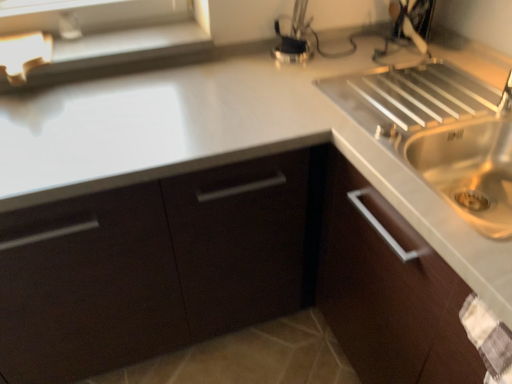
Question: Does point (103, 9) appear closer or farther from the camera than point (221, 208)?

Choices:
 (A) closer
 (B) farther

Answer: (B)

Question: From a real-world perspective, relative to matte dark brown cabinet at center, is matte white window sill at upper left vertically above or below?

Choices:
 (A) above
 (B) below

Answer: (A)

Question: Visually, is matte white window sill at upper left positioned to the left or to the right of matte dark brown cabinet at center?

Choices:
 (A) right
 (B) left

Answer: (B)

Question: From a real-world perspective, is matte dark brown cabinet at center physically located above or below matte white window sill at upper left?

Choices:
 (A) above
 (B) below

Answer: (B)

Question: From the image's perspective, is matte dark brown cabinet at center positioned above or below matte white window sill at upper left?

Choices:
 (A) above
 (B) below

Answer: (B)

Question: Considering the positions of matte dark brown cabinet at center and matte white window sill at upper left in the image, is matte dark brown cabinet at center wider or thinner than matte white window sill at upper left?

Choices:
 (A) thin
 (B) wide

Answer: (B)

Question: Considering the positions of matte dark brown cabinet at center and matte white window sill at upper left in the image, is matte dark brown cabinet at center taller or shorter than matte white window sill at upper left?

Choices:
 (A) short
 (B) tall

Answer: (B)